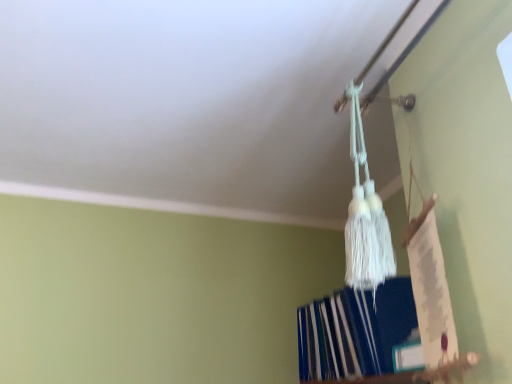
This screenshot has height=384, width=512. What do you see at coordinates (356, 334) in the screenshot?
I see `white tassel at upper center` at bounding box center [356, 334].

Identify the location of white tassel at upper center. The width and height of the screenshot is (512, 384). coord(356,334).

Describe the element at coordinates (162, 205) in the screenshot. I see `white matte trim at upper center` at that location.

I want to click on white matte trim at upper center, so click(162, 205).

Where is `white tassel at upper center`? Image resolution: width=512 pixels, height=384 pixels. white tassel at upper center is located at coordinates (356, 334).

Between white tassel at upper center and white matte trim at upper center, which one appears on the right side from the viewer's perspective?

white tassel at upper center is more to the right.

In the image, is white tassel at upper center positioned in front of or behind white matte trim at upper center?

white tassel at upper center is positioned closer to the viewer than white matte trim at upper center.

Does point (388, 307) lie behind point (295, 221)?

No, (388, 307) is in front of (295, 221).

Looking at this image, from the image's perspective, who appears lower, white tassel at upper center or white matte trim at upper center?

white tassel at upper center, from the image's perspective.

From the picture: From a real-world perspective, is white tassel at upper center on top of white matte trim at upper center?

No.

Considering the sizes of white tassel at upper center and white matte trim at upper center in the image, is white tassel at upper center wider or thinner than white matte trim at upper center?

white tassel at upper center is wider than white matte trim at upper center.

In the scene shown: Is white tassel at upper center taller than white matte trim at upper center?

Correct, white tassel at upper center is much taller as white matte trim at upper center.

In terms of size, does white tassel at upper center appear bigger or smaller than white matte trim at upper center?

In the image, white tassel at upper center appears to be larger than white matte trim at upper center.

Is white tassel at upper center not inside white matte trim at upper center?

That's correct, white tassel at upper center is outside of white matte trim at upper center.

Can you see white tassel at upper center touching white matte trim at upper center?

No, white tassel at upper center is not next to white matte trim at upper center.

Could you tell me if white tassel at upper center is turned towards white matte trim at upper center?

No, white tassel at upper center is not facing towards white matte trim at upper center.

Can you tell me how much white tassel at upper center and white matte trim at upper center differ in facing direction?

They differ by 87.5 degrees in their facing directions.

Find the location of `book located on the right of white matte trim at upper center`. book located on the right of white matte trim at upper center is located at coordinates (356, 334).

Considering the relative positions of white matte trim at upper center and white tassel at upper center in the image provided, is white matte trim at upper center to the left of white tassel at upper center from the viewer's perspective?

Yes.

Is the position of white matte trim at upper center more distant than that of white tassel at upper center?

Yes, white matte trim at upper center is further from the viewer.

Considering the points (287, 220) and (344, 305), which point is in front, point (287, 220) or point (344, 305)?

Positioned in front is point (344, 305).

From the image's perspective, which object appears higher, white matte trim at upper center or white tassel at upper center?

white matte trim at upper center.

From a real-world perspective, is white matte trim at upper center physically below white tassel at upper center?

No, from a real-world perspective, white matte trim at upper center is not under white tassel at upper center.

Can you confirm if white matte trim at upper center is thinner than white tassel at upper center?

Yes, white matte trim at upper center is thinner than white tassel at upper center.

Between white matte trim at upper center and white tassel at upper center, which one has more height?

white tassel at upper center.

Considering the sizes of objects white matte trim at upper center and white tassel at upper center in the image provided, who is smaller, white matte trim at upper center or white tassel at upper center?

Smaller between the two is white matte trim at upper center.

Would you say white matte trim at upper center is outside white tassel at upper center?

Yes, white matte trim at upper center is not within white tassel at upper center.

Is white matte trim at upper center far from white tassel at upper center?

No, there isn't a large distance between white matte trim at upper center and white tassel at upper center.

Could you tell me if white matte trim at upper center is facing white tassel at upper center?

No, white matte trim at upper center is not facing towards white tassel at upper center.

Can you tell me how much white matte trim at upper center and white tassel at upper center differ in facing direction?

The angle between the facing direction of white matte trim at upper center and the facing direction of white tassel at upper center is 87.5 degrees.

How much distance is there between white matte trim at upper center and white tassel at upper center?

white matte trim at upper center is 31.13 inches from white tassel at upper center.

The width and height of the screenshot is (512, 384). What are the coordinates of `book below the white matte trim at upper center (from the image's perspective)` in the screenshot? It's located at (356, 334).

In the image, there is a white matte trim at upper center. Identify the location of book below it (from a real-world perspective). The image size is (512, 384). (356, 334).

The height and width of the screenshot is (384, 512). Find the location of `trim on the left of white tassel at upper center`. trim on the left of white tassel at upper center is located at coordinates (162, 205).